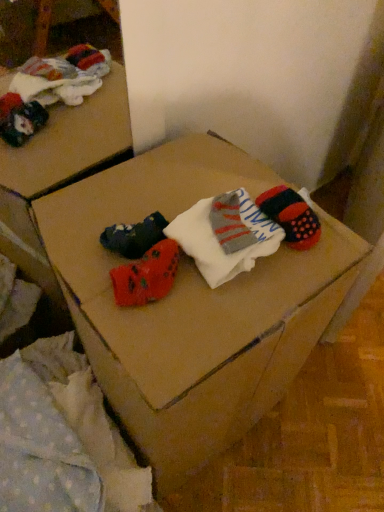
Question: Is light blue polka dot fabric at lower left at the left side of cardboard box at center?

Choices:
 (A) yes
 (B) no

Answer: (A)

Question: Is light blue polka dot fabric at lower left next to cardboard box at center and touching it?

Choices:
 (A) yes
 (B) no

Answer: (B)

Question: Is light blue polka dot fabric at lower left facing away from cardboard box at center?

Choices:
 (A) yes
 (B) no

Answer: (B)

Question: Does light blue polka dot fabric at lower left have a smaller size compared to cardboard box at center?

Choices:
 (A) yes
 (B) no

Answer: (A)

Question: Can you confirm if light blue polka dot fabric at lower left is shorter than cardboard box at center?

Choices:
 (A) no
 (B) yes

Answer: (B)

Question: In terms of height, does cardboard box at center look taller or shorter compared to white soft socks at center?

Choices:
 (A) short
 (B) tall

Answer: (B)

Question: Looking at their shapes, would you say cardboard box at center is wider or thinner than white soft socks at center?

Choices:
 (A) thin
 (B) wide

Answer: (B)

Question: Is cardboard box at center in front of or behind white soft socks at center in the image?

Choices:
 (A) behind
 (B) front

Answer: (B)

Question: Visually, is cardboard box at center positioned to the left or to the right of white soft socks at center?

Choices:
 (A) right
 (B) left

Answer: (B)

Question: Is light blue polka dot fabric at lower left wider or thinner than cardboard box at center?

Choices:
 (A) thin
 (B) wide

Answer: (B)

Question: Visually, is light blue polka dot fabric at lower left positioned to the left or to the right of cardboard box at center?

Choices:
 (A) right
 (B) left

Answer: (B)

Question: Would you say light blue polka dot fabric at lower left is inside or outside cardboard box at center?

Choices:
 (A) inside
 (B) outside

Answer: (B)

Question: In terms of size, does light blue polka dot fabric at lower left appear bigger or smaller than cardboard box at center?

Choices:
 (A) small
 (B) big

Answer: (A)

Question: Would you say light blue polka dot fabric at lower left is inside or outside white soft socks at center?

Choices:
 (A) inside
 (B) outside

Answer: (B)

Question: Is light blue polka dot fabric at lower left to the left or to the right of white soft socks at center in the image?

Choices:
 (A) left
 (B) right

Answer: (A)